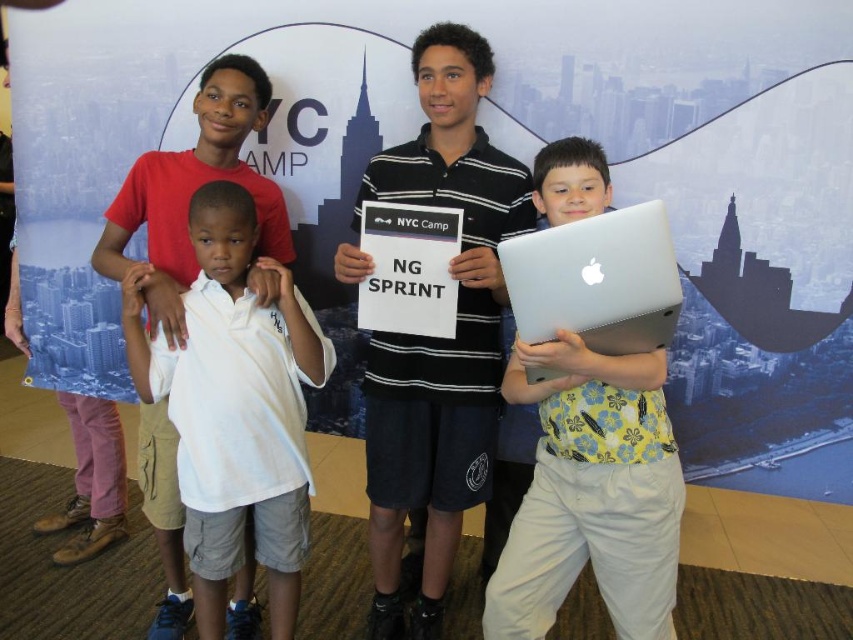
In the scene shown: Who is positioned more to the left, white cotton shirt at center or silver metallic laptop at right?

Positioned to the left is white cotton shirt at center.

In the scene shown: Between white cotton shirt at center and silver metallic laptop at right, which one has less height?

With less height is silver metallic laptop at right.

Is point (151, 388) closer to viewer compared to point (592, 266)?

No, (151, 388) is further to viewer.

Locate an element on the screen. This screenshot has height=640, width=853. white cotton shirt at center is located at coordinates (234, 406).

Can you confirm if white cotton shirt at center is positioned to the right of silver metallic laptop at center?

No, white cotton shirt at center is not to the right of silver metallic laptop at center.

Does point (271, 637) come farther from viewer compared to point (670, 595)?

Yes, point (271, 637) is behind point (670, 595).

In order to click on white cotton shirt at center in this screenshot , I will do `click(234, 406)`.

Which of these two, black striped polo shirt at center or white cotton shirt at center, stands taller?

black striped polo shirt at center is taller.

Describe the element at coordinates (438, 339) in the screenshot. I see `black striped polo shirt at center` at that location.

The height and width of the screenshot is (640, 853). What are the coordinates of `black striped polo shirt at center` in the screenshot? It's located at (438, 339).